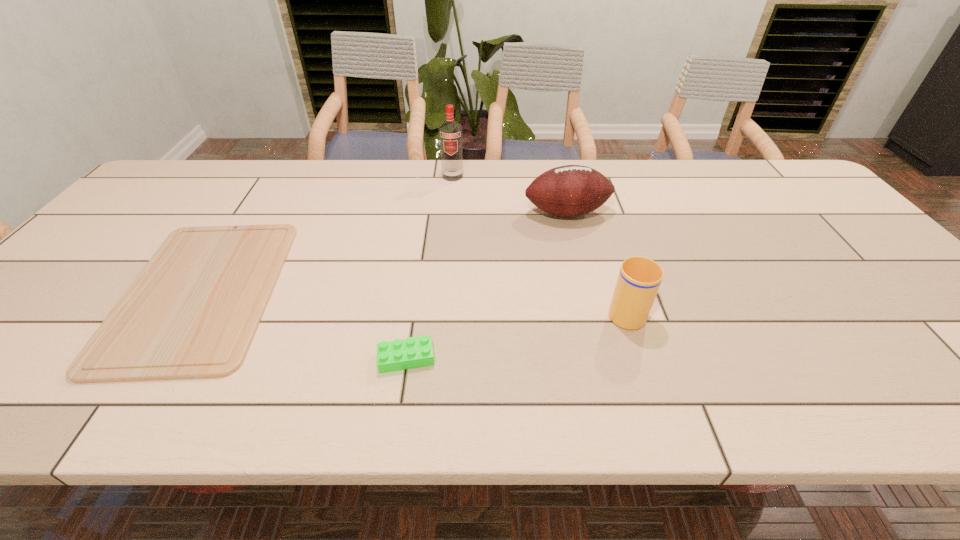
You are a GUI agent. You are given a task and a screenshot of the screen. Output one action in this format:
    pyautogui.click(x=<x>, y=<y>)
    Task: Click on the vacant space that is in between the Lego and the cup
    The image size is (960, 540).
    Given the screenshot: What is the action you would take?
    pyautogui.click(x=516, y=334)

You are a GUI agent. You are given a task and a screenshot of the screen. Output one action in this format:
    pyautogui.click(x=<x>, y=<y>)
    Task: Click on the free space between the fourth tallest object and the farthest object
    This screenshot has width=960, height=540.
    Given the screenshot: What is the action you would take?
    pyautogui.click(x=429, y=267)

Locate an element on the screen. object that is the second nearest to the cup is located at coordinates (409, 353).

Image resolution: width=960 pixels, height=540 pixels. I want to click on the third closest object to the Lego, so click(572, 190).

The image size is (960, 540). Identify the location of free location that satisfies the following two spatial constraints: 1. on the front label of the football (American); 2. on the right side of the farthest object. pos(449,212).

Find the location of a particular element. Image resolution: width=960 pixels, height=540 pixels. free point that satisfies the following two spatial constraints: 1. on the front side of the leftmost object; 2. on the left side of the second shortest object is located at coordinates (158, 359).